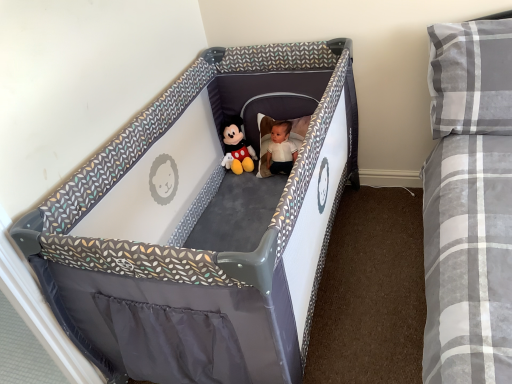
Question: Based on their positions, is gray fabric playpen at center located to the left or right of soft plush mickey mouse at center?

Choices:
 (A) right
 (B) left

Answer: (A)

Question: Is gray fabric playpen at center bigger or smaller than soft plush mickey mouse at center?

Choices:
 (A) small
 (B) big

Answer: (B)

Question: Estimate the real-world distances between objects in this image. Which object is closer to the gray plaid pillow at upper right?

Choices:
 (A) soft plush mickey mouse at center
 (B) gray fabric playpen at center

Answer: (B)

Question: Estimate the real-world distances between objects in this image. Which object is farther from the soft plush mickey mouse at center?

Choices:
 (A) gray fabric playpen at center
 (B) gray plaid pillow at upper right

Answer: (B)